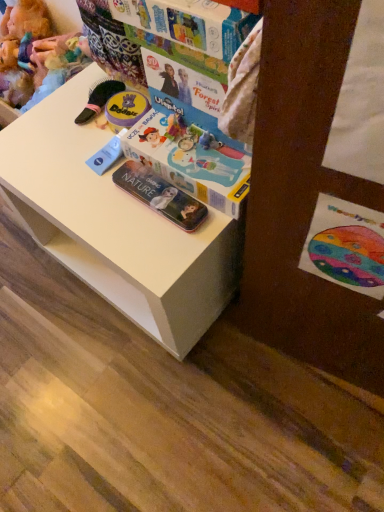
Question: Is multicolored cardboard book at upper center smaller than white plastic changing table at center?

Choices:
 (A) no
 (B) yes

Answer: (B)

Question: From the image's perspective, does multicolored cardboard book at upper center appear lower than white plastic changing table at center?

Choices:
 (A) no
 (B) yes

Answer: (A)

Question: Is multicolored cardboard book at upper center directly adjacent to white plastic changing table at center?

Choices:
 (A) no
 (B) yes

Answer: (A)

Question: Is multicolored cardboard book at upper center taller than white plastic changing table at center?

Choices:
 (A) no
 (B) yes

Answer: (A)

Question: Is multicolored cardboard book at upper center behind white plastic changing table at center?

Choices:
 (A) no
 (B) yes

Answer: (A)

Question: Does multicolored cardboard book at upper center turn towards white plastic changing table at center?

Choices:
 (A) no
 (B) yes

Answer: (A)

Question: Is fuzzy fabric doll at upper left completely or partially outside of transparent plastic case at lower center?

Choices:
 (A) no
 (B) yes

Answer: (B)

Question: From the image's perspective, is fuzzy fabric doll at upper left above transparent plastic case at lower center?

Choices:
 (A) no
 (B) yes

Answer: (B)

Question: From a real-world perspective, is fuzzy fabric doll at upper left on top of transparent plastic case at lower center?

Choices:
 (A) yes
 (B) no

Answer: (B)

Question: Is fuzzy fabric doll at upper left closer to camera compared to transparent plastic case at lower center?

Choices:
 (A) no
 (B) yes

Answer: (A)

Question: Is fuzzy fabric doll at upper left facing away from transparent plastic case at lower center?

Choices:
 (A) no
 (B) yes

Answer: (A)

Question: Does fuzzy fabric doll at upper left turn towards transparent plastic case at lower center?

Choices:
 (A) yes
 (B) no

Answer: (B)

Question: Is multicolored cardboard book at upper center closer to camera compared to transparent plastic case at lower center?

Choices:
 (A) no
 (B) yes

Answer: (B)